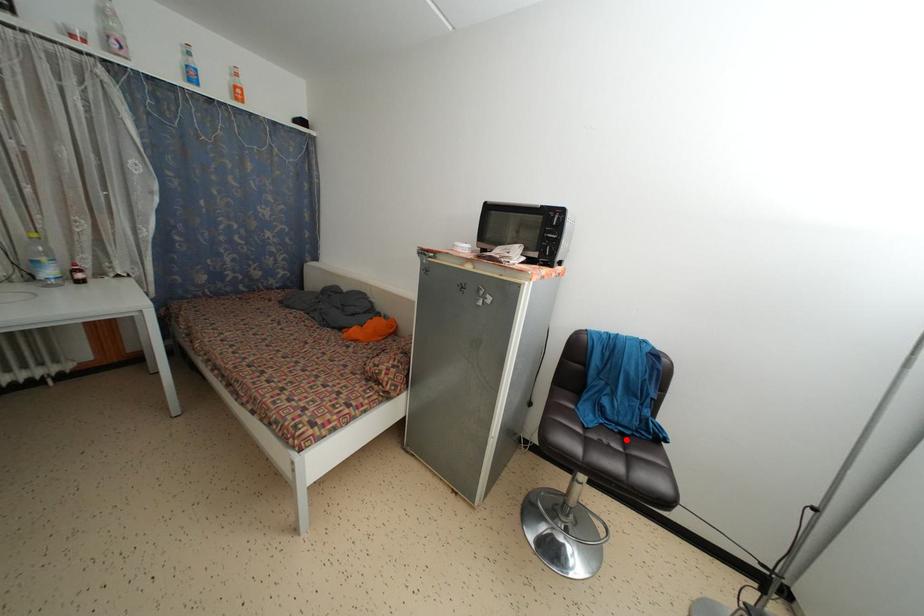
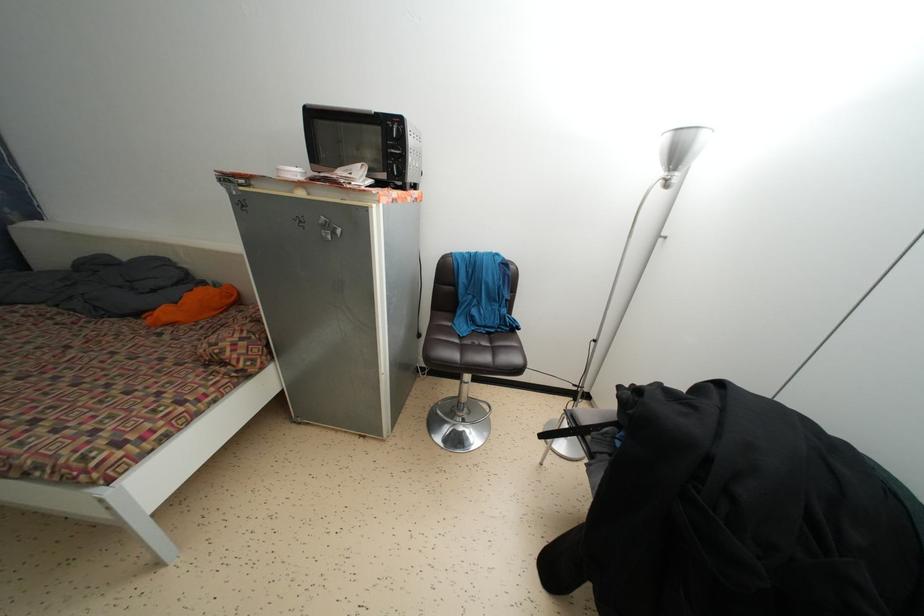
Find the pixel in the second image that matches the highlighted location in the first image.

(492, 339)